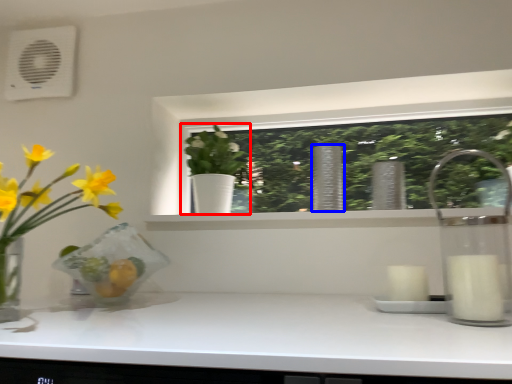
Question: Which of the following is the farthest to the observer, houseplant (highlighted by a red box) or vase (highlighted by a blue box)?

Choices:
 (A) houseplant
 (B) vase

Answer: (A)